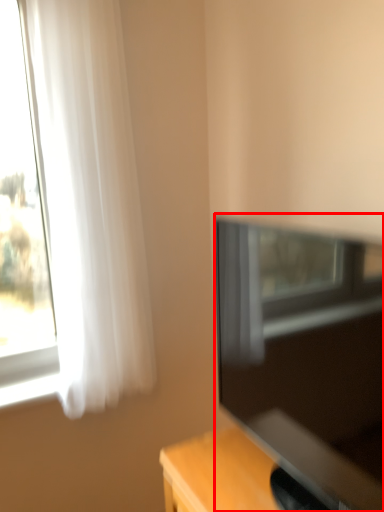
Question: From the image's perspective, where is television (annotated by the red box) located in relation to curtain in the image?

Choices:
 (A) below
 (B) above

Answer: (A)